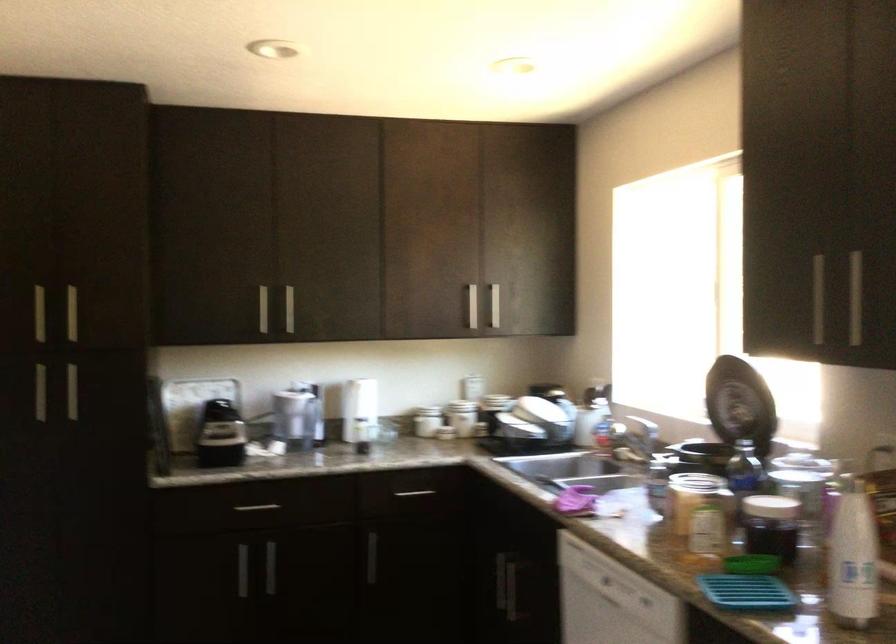
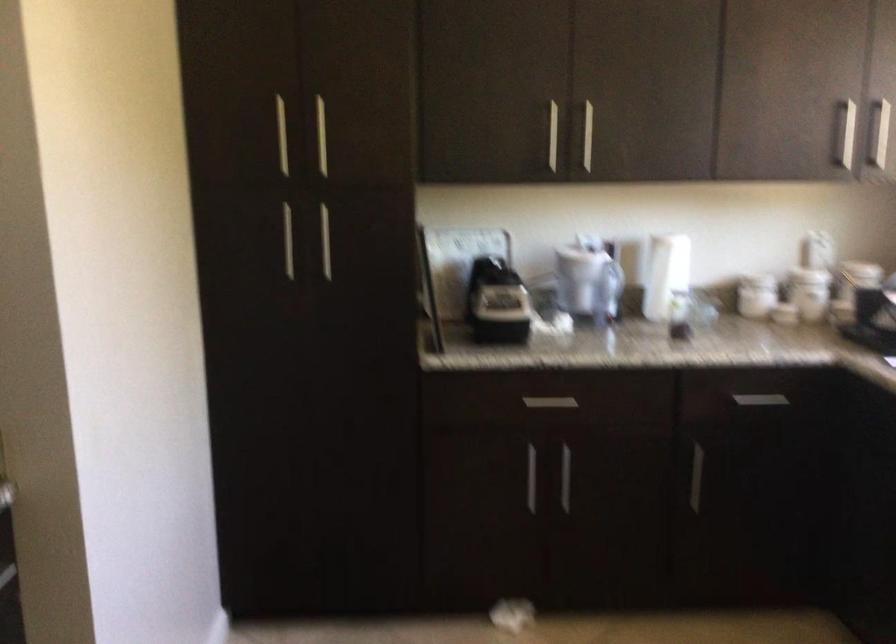
Find the pixel in the second image that matches (x=250, y=572) in the first image.

(530, 478)